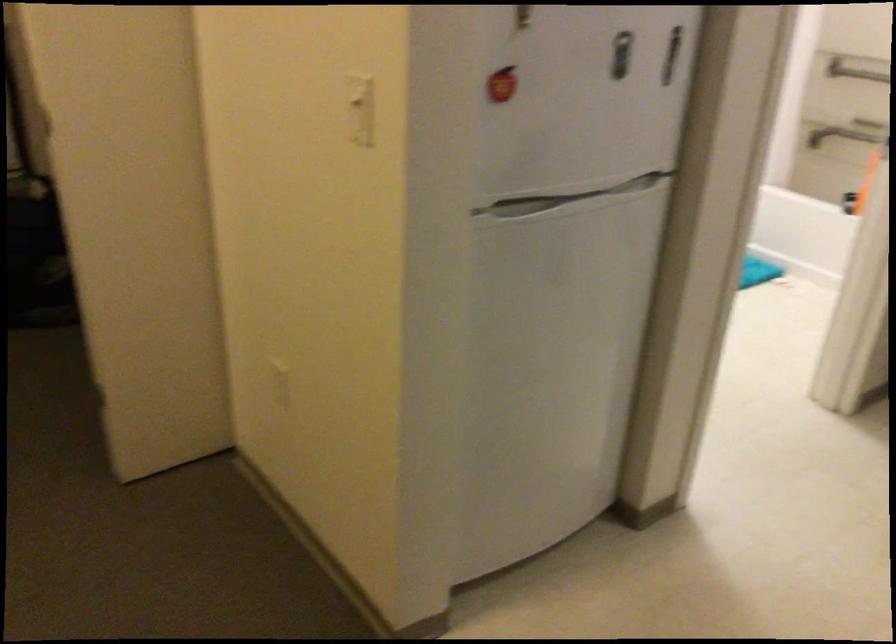
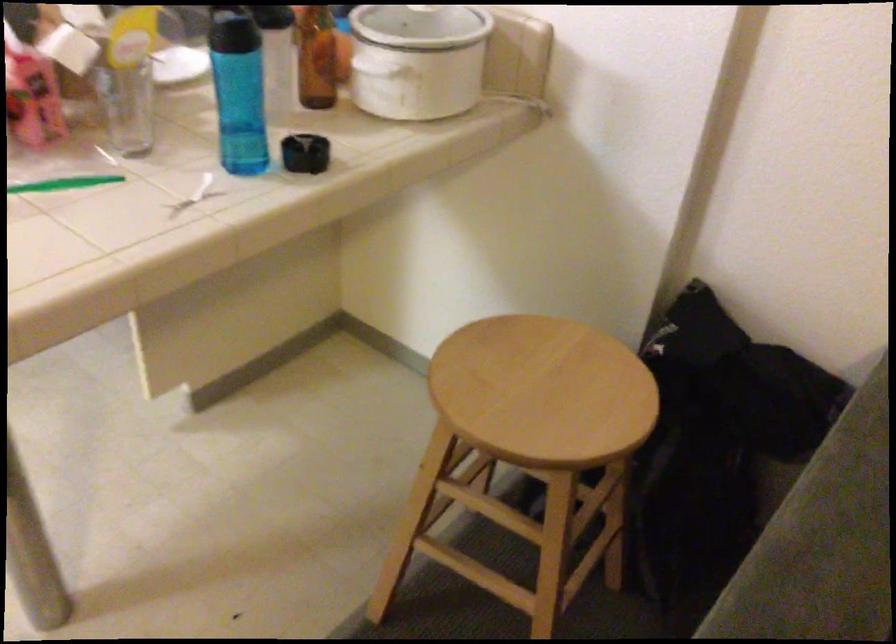
The first image is from the beginning of the video and the second image is from the end. How did the camera likely rotate when shooting the video?

The camera's rotation is toward right-down.